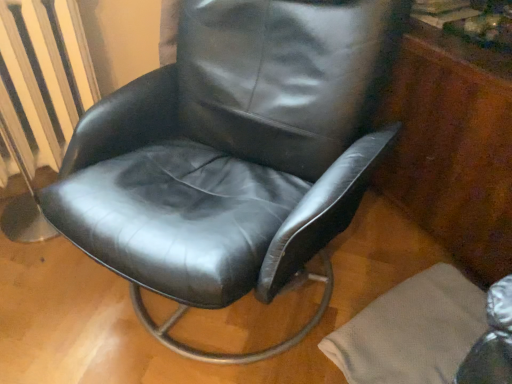
Question: From a real-world perspective, is metallic silver radiator at left positioned under black leather chair at center based on gravity?

Choices:
 (A) no
 (B) yes

Answer: (B)

Question: Considering the relative sizes of metallic silver radiator at left and black leather chair at center in the image provided, is metallic silver radiator at left shorter than black leather chair at center?

Choices:
 (A) no
 (B) yes

Answer: (B)

Question: From the image's perspective, is metallic silver radiator at left beneath black leather chair at center?

Choices:
 (A) no
 (B) yes

Answer: (A)

Question: Is metallic silver radiator at left behind black leather chair at center?

Choices:
 (A) no
 (B) yes

Answer: (B)

Question: Can you confirm if metallic silver radiator at left is bigger than black leather chair at center?

Choices:
 (A) no
 (B) yes

Answer: (A)

Question: From the image's perspective, relative to black leather chair at center, is metallic silver radiator at left above or below?

Choices:
 (A) above
 (B) below

Answer: (A)

Question: Based on their positions, is metallic silver radiator at left located to the left or right of black leather chair at center?

Choices:
 (A) left
 (B) right

Answer: (A)

Question: Considering the positions of metallic silver radiator at left and black leather chair at center in the image, is metallic silver radiator at left taller or shorter than black leather chair at center?

Choices:
 (A) short
 (B) tall

Answer: (A)

Question: In terms of size, does metallic silver radiator at left appear bigger or smaller than black leather chair at center?

Choices:
 (A) small
 (B) big

Answer: (A)

Question: In the image, is metallic silver radiator at left on the left side or the right side of mahogany wood dresser at right?

Choices:
 (A) left
 (B) right

Answer: (A)

Question: Is metallic silver radiator at left situated inside mahogany wood dresser at right or outside?

Choices:
 (A) inside
 (B) outside

Answer: (B)

Question: Considering the positions of point (59, 9) and point (395, 64), is point (59, 9) closer or farther from the camera than point (395, 64)?

Choices:
 (A) closer
 (B) farther

Answer: (A)

Question: Based on their sizes in the image, would you say metallic silver radiator at left is bigger or smaller than mahogany wood dresser at right?

Choices:
 (A) big
 (B) small

Answer: (B)

Question: From the image's perspective, is black leather chair at center located above or below mahogany wood dresser at right?

Choices:
 (A) above
 (B) below

Answer: (B)

Question: Is black leather chair at center spatially inside mahogany wood dresser at right, or outside of it?

Choices:
 (A) outside
 (B) inside

Answer: (A)